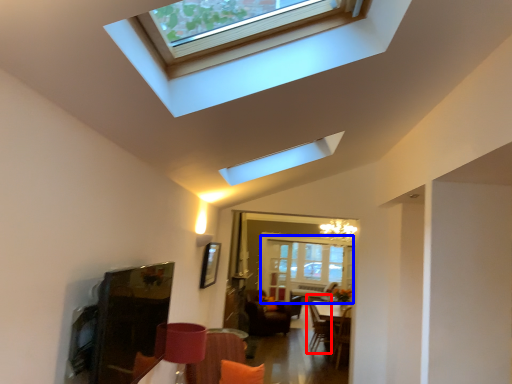
Question: Which of the following is the farthest to the observer, swivel chair (highlighted by a red box) or glass door (highlighted by a blue box)?

Choices:
 (A) swivel chair
 (B) glass door

Answer: (B)